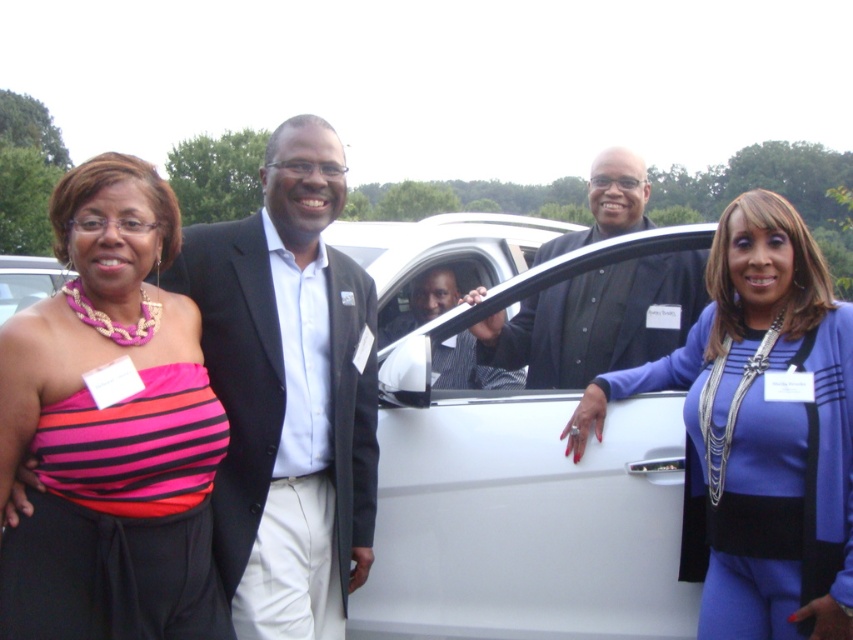
Is the position of pink striped fabric at left less distant than that of black glossy suit at center?

Yes, it is.

Which is below, pink striped fabric at left or black glossy suit at center?

pink striped fabric at left

Where is `pink striped fabric at left`? This screenshot has width=853, height=640. pink striped fabric at left is located at coordinates (111, 429).

Is point (109, 486) positioned after point (802, 356)?

No, (109, 486) is in front of (802, 356).

Is pink striped fabric at left bigger than blue satin dress at right?

Indeed, pink striped fabric at left has a larger size compared to blue satin dress at right.

The width and height of the screenshot is (853, 640). In order to click on pink striped fabric at left in this screenshot , I will do `click(111, 429)`.

Is point (538, 627) closer to viewer compared to point (634, 342)?

Yes, it is.

Who is more forward, (468, 516) or (567, 355)?

Point (468, 516)

Where is `white matte car at center`? white matte car at center is located at coordinates (521, 452).